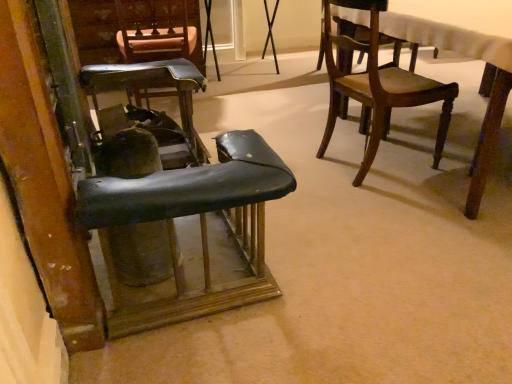
Question: Is leather-like brown chair at upper center, which is the 4th chair in right-to-left order, located within leather-like black chair at left, the second chair positioned from the right?

Choices:
 (A) no
 (B) yes

Answer: (A)

Question: From the image's perspective, does leather-like black chair at left, which is counted as the third chair, starting from the left, appear higher than leather-like brown chair at upper center, which is the 4th chair in right-to-left order?

Choices:
 (A) no
 (B) yes

Answer: (A)

Question: From the image's perspective, does leather-like black chair at left, which is counted as the third chair, starting from the left, appear lower than leather-like brown chair at upper center, which is the 4th chair in right-to-left order?

Choices:
 (A) yes
 (B) no

Answer: (A)

Question: Does leather-like black chair at left, which is counted as the third chair, starting from the left, come in front of leather-like brown chair at upper center, which is the 4th chair in right-to-left order?

Choices:
 (A) no
 (B) yes

Answer: (B)

Question: Is leather-like black chair at left, the second chair positioned from the right, at the left side of leather-like brown chair at upper center, which is the 1th chair from left to right?

Choices:
 (A) no
 (B) yes

Answer: (A)

Question: Is leather-like black chair at left, which is counted as the third chair, starting from the left, located outside leather-like brown chair at upper center, which is the 4th chair in right-to-left order?

Choices:
 (A) no
 (B) yes

Answer: (B)

Question: Is leather-like black chair at center-left, which ranks as the second chair in left-to-right order, directly adjacent to wooden chair at upper right, the 1th chair from the right?

Choices:
 (A) yes
 (B) no

Answer: (B)

Question: Could you tell me if leather-like black chair at center-left, which ranks as the second chair in left-to-right order, is facing wooden chair at upper right, the 1th chair from the right?

Choices:
 (A) no
 (B) yes

Answer: (B)

Question: Is wooden chair at upper right, which is the 4th chair from left to right, a part of leather-like black chair at center-left, which ranks as the second chair in left-to-right order?

Choices:
 (A) no
 (B) yes

Answer: (A)

Question: Is leather-like black chair at center-left, the 3th chair positioned from the right, positioned with its back to wooden chair at upper right, which is the 4th chair from left to right?

Choices:
 (A) yes
 (B) no

Answer: (B)

Question: Is the position of leather-like black chair at center-left, the 3th chair positioned from the right, less distant than that of wooden chair at upper right, which is the 4th chair from left to right?

Choices:
 (A) yes
 (B) no

Answer: (B)

Question: Is wooden chair at upper right, which is the 4th chair from left to right, closer to the viewer compared to leather-like black chair at center-left, the 3th chair positioned from the right?

Choices:
 (A) yes
 (B) no

Answer: (A)